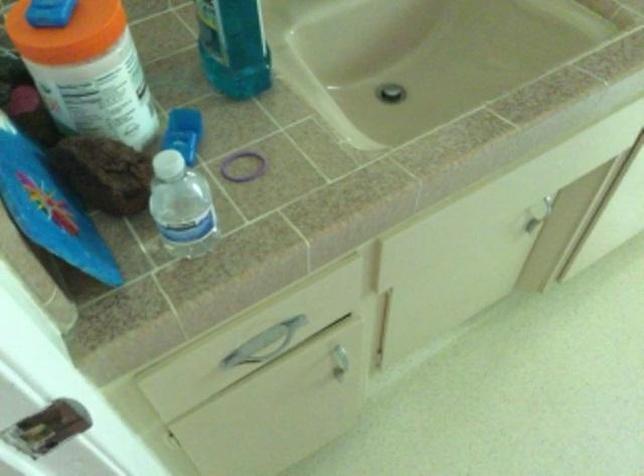
Identify the location of silver drawer handle. (265, 343).